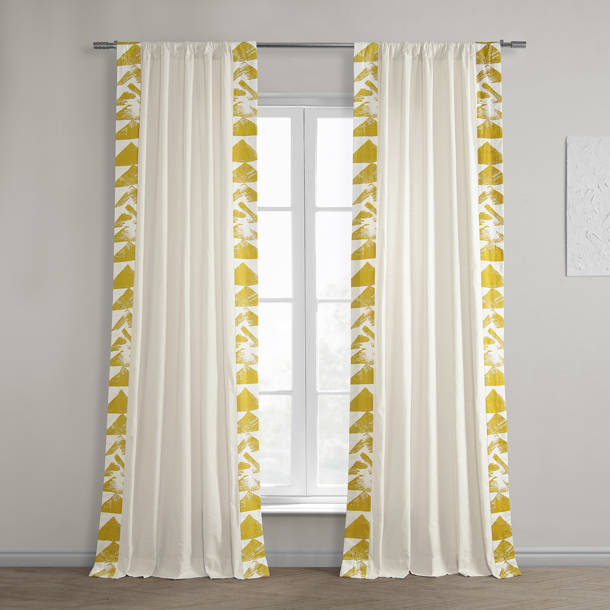
What are the coordinates of `curtain` in the screenshot? It's located at (436, 289), (169, 285).